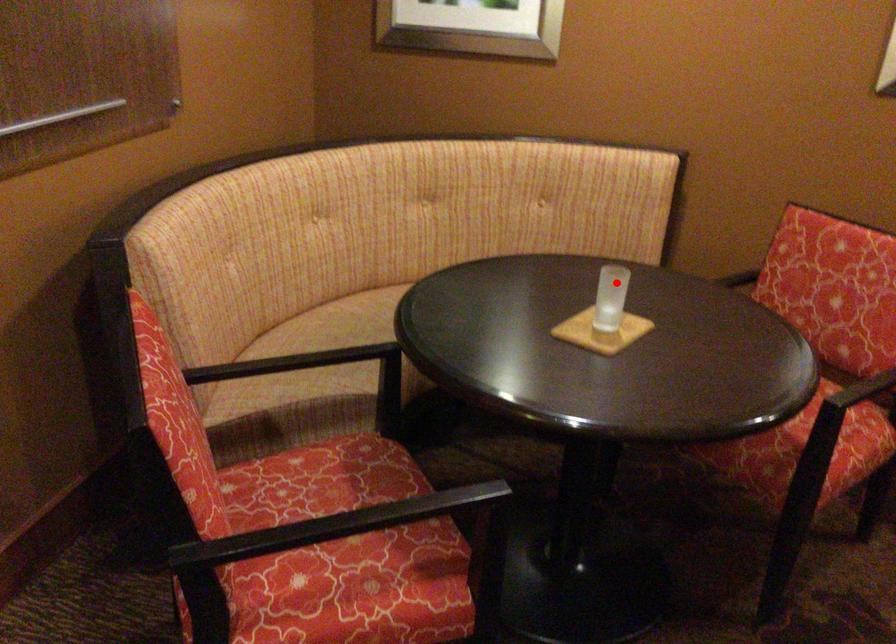
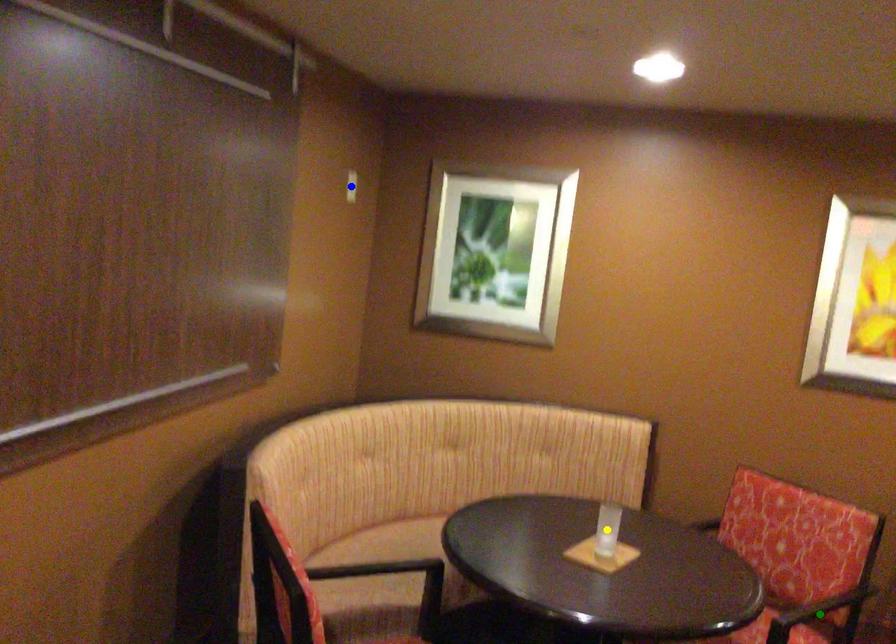
Question: I am providing you with two images of the same scene from different viewpoints. A red point is marked on the first image. You are given multiple points on the second image. In image 2, which mark is for the same physical point as the one in image 1?

Choices:
 (A) blue point
 (B) green point
 (C) yellow point

Answer: (C)